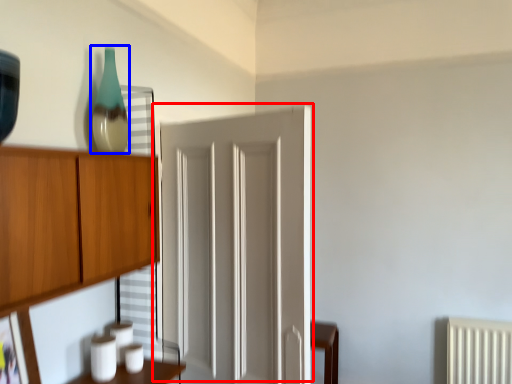
Question: Which of the following is the farthest to the observer, door (highlighted by a red box) or glass vase (highlighted by a blue box)?

Choices:
 (A) door
 (B) glass vase

Answer: (B)